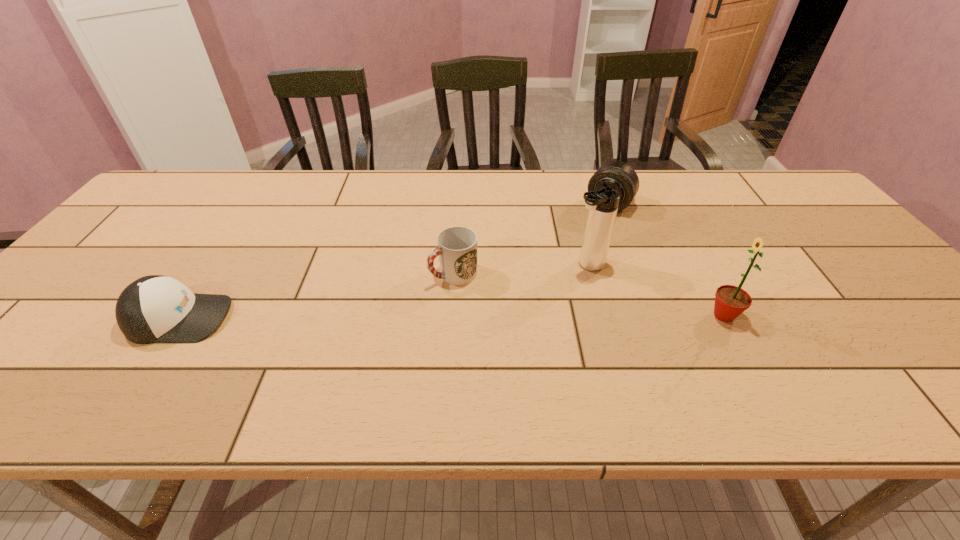
This screenshot has width=960, height=540. What are the coordinates of `object present at the near edge` in the screenshot? It's located at (153, 309).

The image size is (960, 540). In the image, there is a desktop. What are the coordinates of `vacant space at the far edge` in the screenshot? It's located at (740, 206).

The image size is (960, 540). In the image, there is a desktop. What are the coordinates of `free region at the near edge` in the screenshot? It's located at coord(372,359).

What are the coordinates of `vacant space at the left edge` in the screenshot? It's located at (77, 318).

Where is `vacant space at the far left corner of the desktop`? vacant space at the far left corner of the desktop is located at coordinates (211, 172).

Locate an element on the screen. The image size is (960, 540). blank space at the far right corner of the desktop is located at coordinates (753, 181).

Find the location of a particular element. vacant region between the rightmost object and the cup is located at coordinates (588, 295).

Where is `vacant area that lies between the cup and the rightmost object`? The image size is (960, 540). vacant area that lies between the cup and the rightmost object is located at coordinates (588, 295).

At what (x,y) coordinates should I click in order to perform the action: click on empty location between the sunflower and the leftmost object. Please return your answer as a coordinate pair (x, y). This screenshot has height=540, width=960. Looking at the image, I should click on (451, 317).

Locate an element on the screen. This screenshot has height=540, width=960. vacant region between the cup and the farthest object is located at coordinates (531, 239).